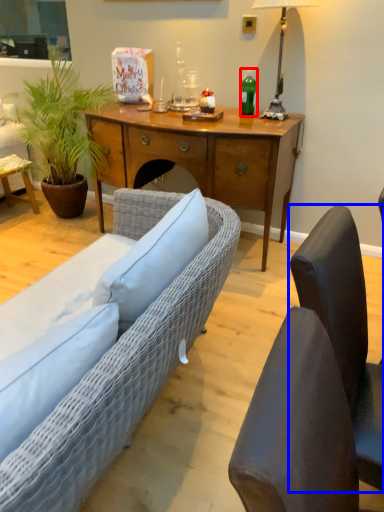
Question: Among these objects, which one is farthest to the camera, bottle (highlighted by a red box) or chair (highlighted by a blue box)?

Choices:
 (A) bottle
 (B) chair

Answer: (A)